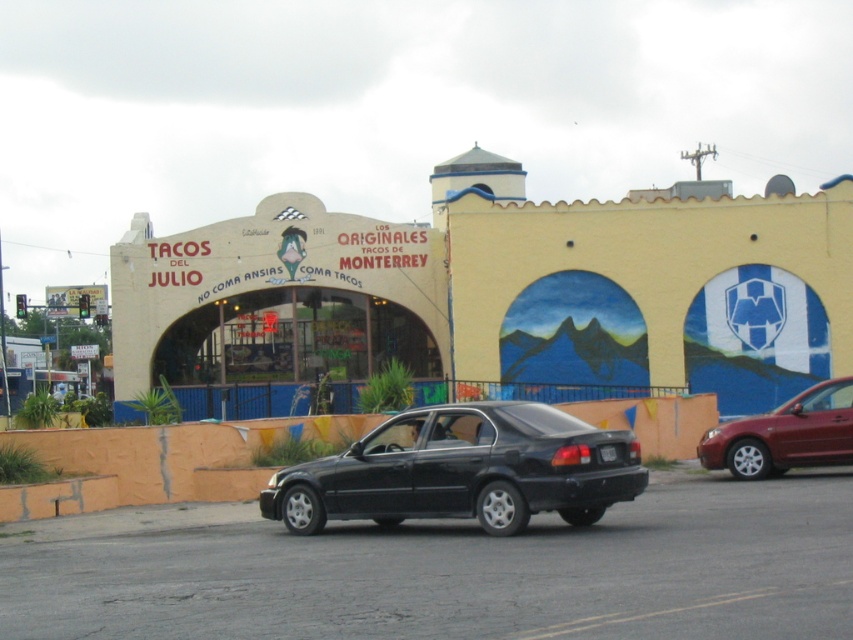
Question: Is maroon metallic sedan at right positioned at the back of black plastic license plate at rear?

Choices:
 (A) no
 (B) yes

Answer: (B)

Question: Which of the following is the closest to the observer?

Choices:
 (A) maroon metallic sedan at right
 (B) matte black sedan at center

Answer: (B)

Question: Which point is closer to the camera?

Choices:
 (A) (749, 480)
 (B) (608, 452)

Answer: (B)

Question: Among these points, which one is farthest from the camera?

Choices:
 (A) (387, 525)
 (B) (705, 458)

Answer: (B)

Question: Can you confirm if matte black sedan at center is bigger than maroon metallic sedan at right?

Choices:
 (A) no
 (B) yes

Answer: (B)

Question: Is maroon metallic sedan at right positioned before black plastic license plate at rear?

Choices:
 (A) yes
 (B) no

Answer: (B)